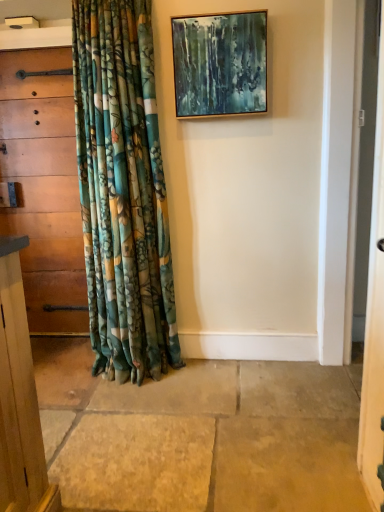
Question: Is wooden picture frame at upper center situated inside wooden chest of drawers at left or outside?

Choices:
 (A) inside
 (B) outside

Answer: (B)

Question: Is point (173, 58) positioned closer to the camera than point (29, 271)?

Choices:
 (A) closer
 (B) farther

Answer: (A)

Question: Looking at their shapes, would you say wooden picture frame at upper center is wider or thinner than wooden chest of drawers at left?

Choices:
 (A) thin
 (B) wide

Answer: (A)

Question: From the image's perspective, relative to wooden picture frame at upper center, is wooden chest of drawers at left above or below?

Choices:
 (A) above
 (B) below

Answer: (B)

Question: Choose the correct answer: Is wooden chest of drawers at left inside wooden picture frame at upper center or outside it?

Choices:
 (A) inside
 (B) outside

Answer: (B)

Question: In terms of width, does wooden chest of drawers at left look wider or thinner when compared to wooden picture frame at upper center?

Choices:
 (A) wide
 (B) thin

Answer: (A)

Question: From a real-world perspective, is wooden chest of drawers at left positioned above or below wooden picture frame at upper center?

Choices:
 (A) above
 (B) below

Answer: (B)